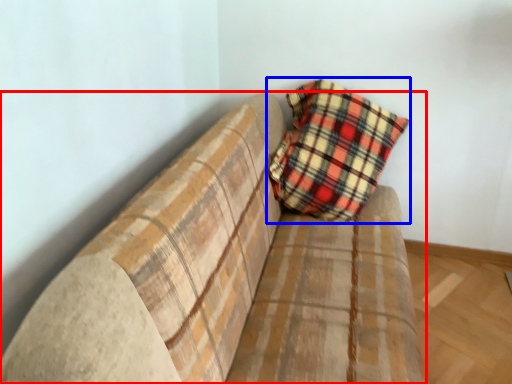
Question: Which object appears farthest to the camera in this image, studio couch (highlighted by a red box) or pillow (highlighted by a blue box)?

Choices:
 (A) studio couch
 (B) pillow

Answer: (B)